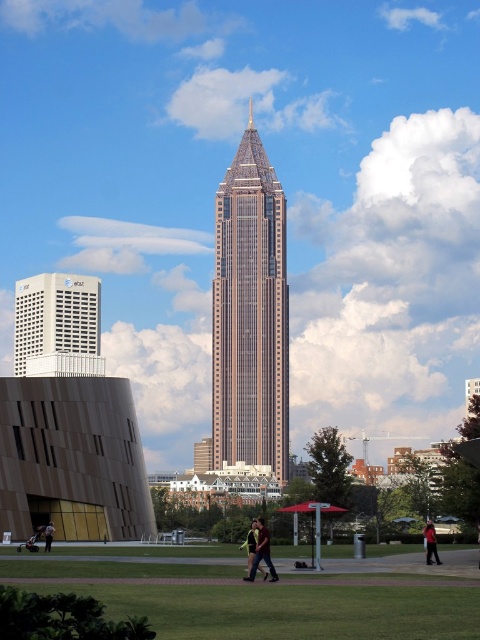
You are standing at the point marked by the coordinates [250,314] in the image. What is the name of the building you are currently located in?

You are located in the gold_tipped glass skyscraper at center, as the point [250,314] represents its location in the image.

Where is the dark brown leather jacket at center located in the image?

The dark brown leather jacket at center is located at point coordinates of (251,545).